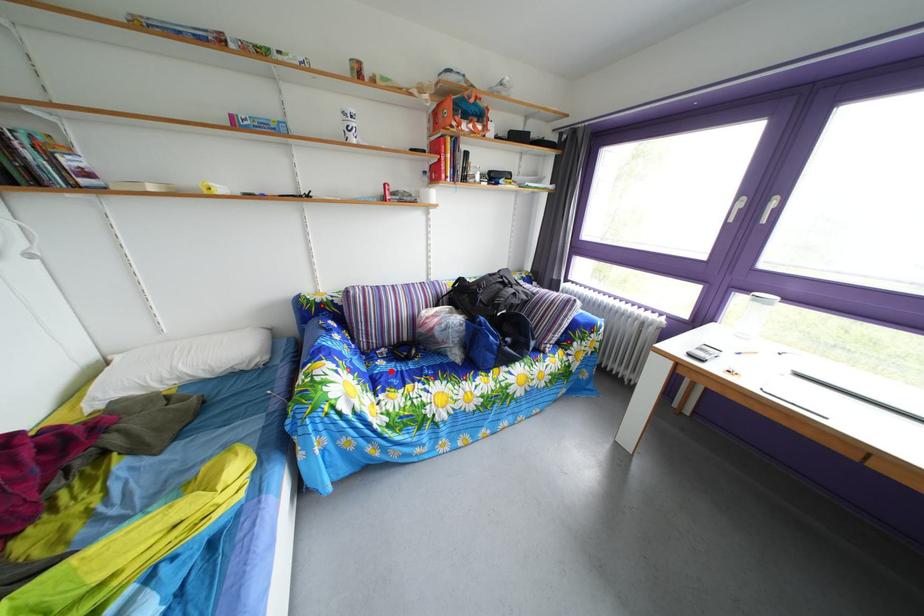
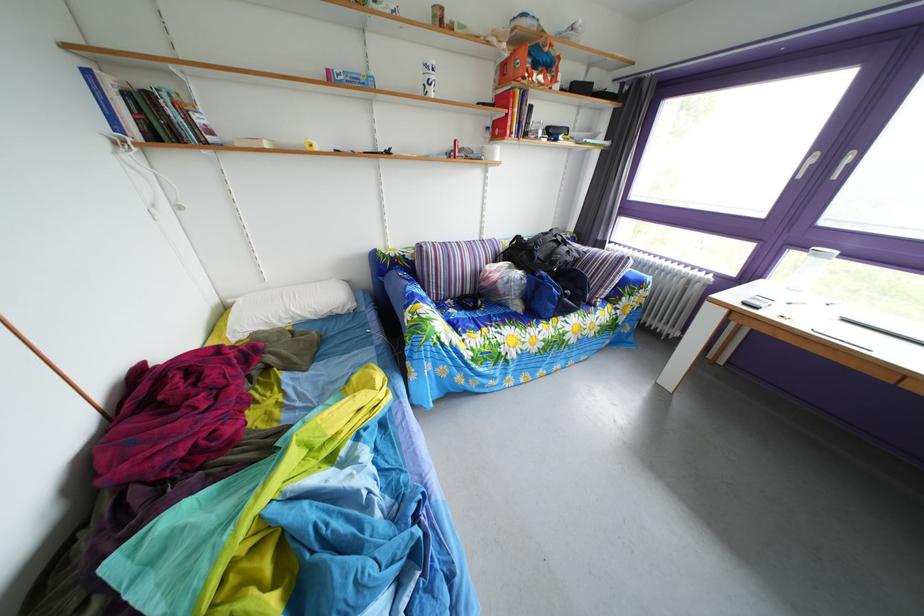
Question: I am providing you with two images of the same scene from different viewpoints. A red point is marked on the first image. At the location where the point appears in image 1, is it still visible in image 2?

Choices:
 (A) Yes
 (B) No

Answer: (A)